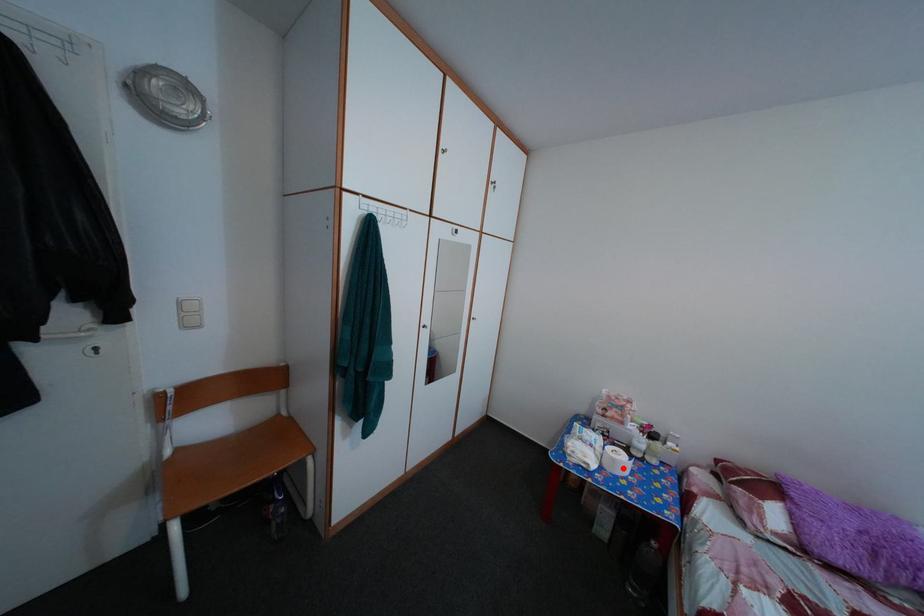
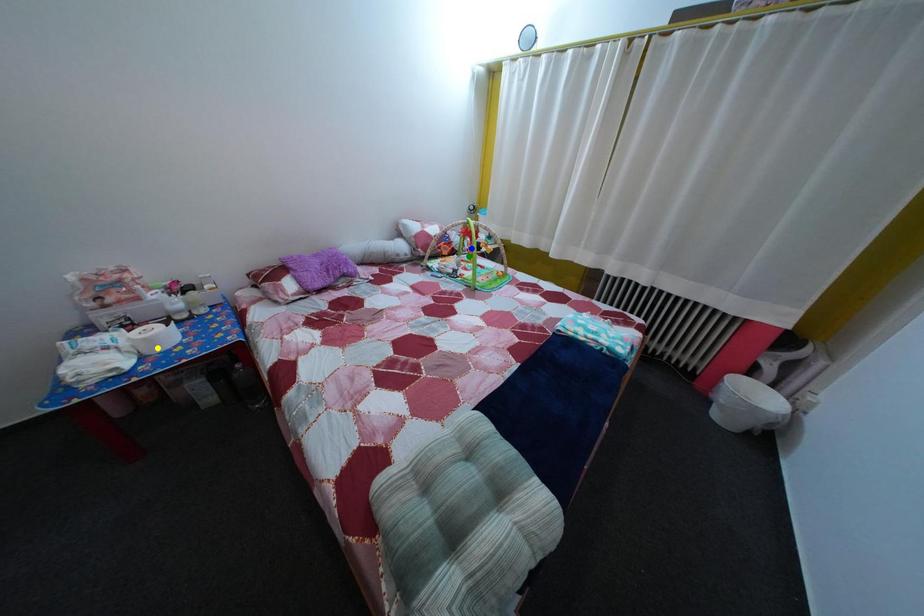
Question: I am providing you with two images of the same scene from different viewpoints. A red point is marked on the first image. You are given multiple points on the second image. Can you choose the point in image 2 that corresponds to the point in image 1?

Choices:
 (A) yellow point
 (B) green point
 (C) blue point

Answer: (A)